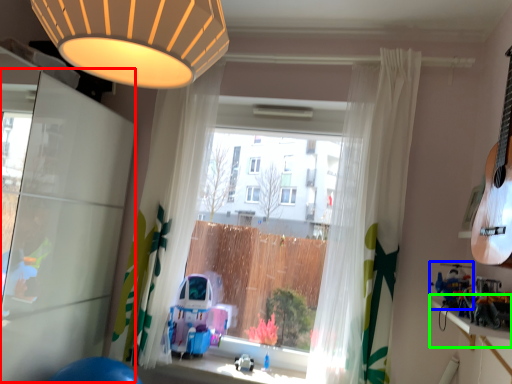
Question: Which object is the farthest from screen door (highlighted by a red box)? Choose among these: toy (highlighted by a blue box) or window sill (highlighted by a green box).

Choices:
 (A) toy
 (B) window sill

Answer: (B)